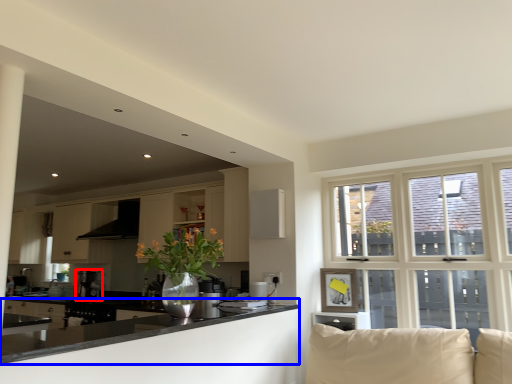
Question: Which point is closer to the camera, coffee machine (highlighted by a red box) or countertop (highlighted by a blue box)?

Choices:
 (A) coffee machine
 (B) countertop

Answer: (B)